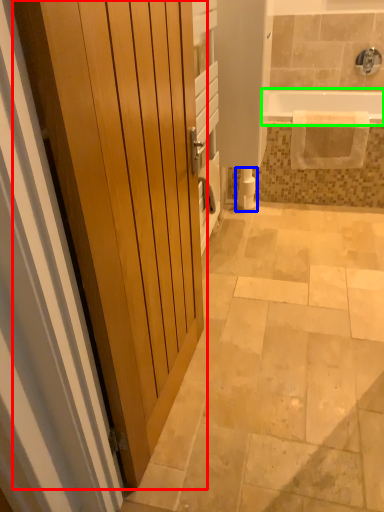
Question: Which object is positioned closest to door (highlighted by a red box)? Select from toilet paper (highlighted by a blue box) and bathtub (highlighted by a green box).

Choices:
 (A) toilet paper
 (B) bathtub

Answer: (A)